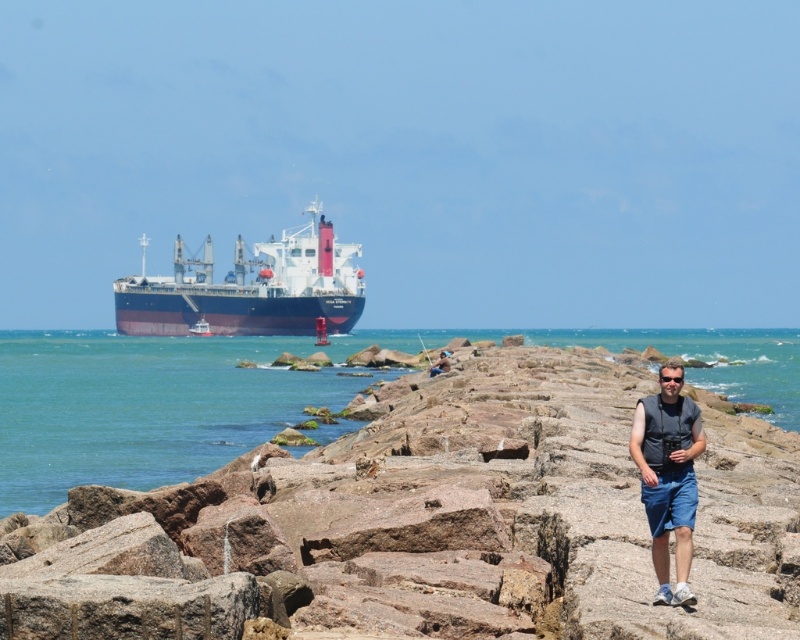
Describe the element at coordinates (250, 289) in the screenshot. I see `dark blue matte cargo ship at center` at that location.

Does dark blue matte cargo ship at center have a larger size compared to dark gray vest at center?

Yes, dark blue matte cargo ship at center is bigger than dark gray vest at center.

The image size is (800, 640). Find the location of `dark blue matte cargo ship at center`. dark blue matte cargo ship at center is located at coordinates (250, 289).

The height and width of the screenshot is (640, 800). I want to click on dark blue matte cargo ship at center, so click(x=250, y=289).

Between point (178, 324) and point (444, 356), which one is positioned behind?

Point (178, 324)

From the picture: Does dark blue matte cargo ship at center appear over blue denim shorts at center-right?

Correct, dark blue matte cargo ship at center is located above blue denim shorts at center-right.

I want to click on dark blue matte cargo ship at center, so click(250, 289).

Looking at this image, does blue water at center have a larger size compared to blue denim shorts at center-right?

Correct, blue water at center is larger in size than blue denim shorts at center-right.

Between blue water at center and blue denim shorts at center-right, which one has less height?

With less height is blue denim shorts at center-right.

Describe the element at coordinates (152, 404) in the screenshot. The image size is (800, 640). I see `blue water at center` at that location.

Identify the location of blue water at center. (152, 404).